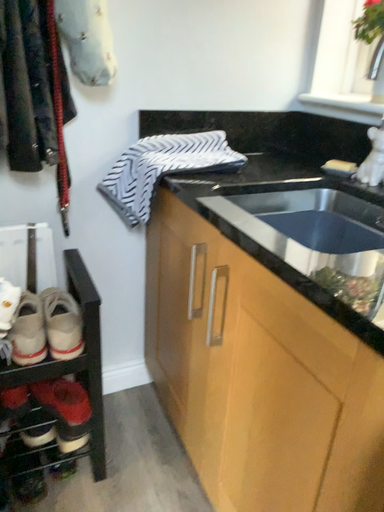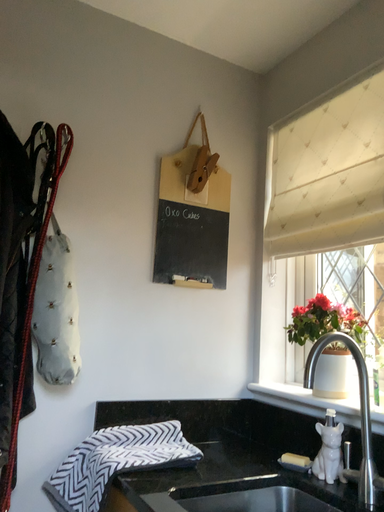
Question: How did the camera likely rotate when shooting the video?

Choices:
 (A) rotated downward
 (B) rotated upward

Answer: (B)